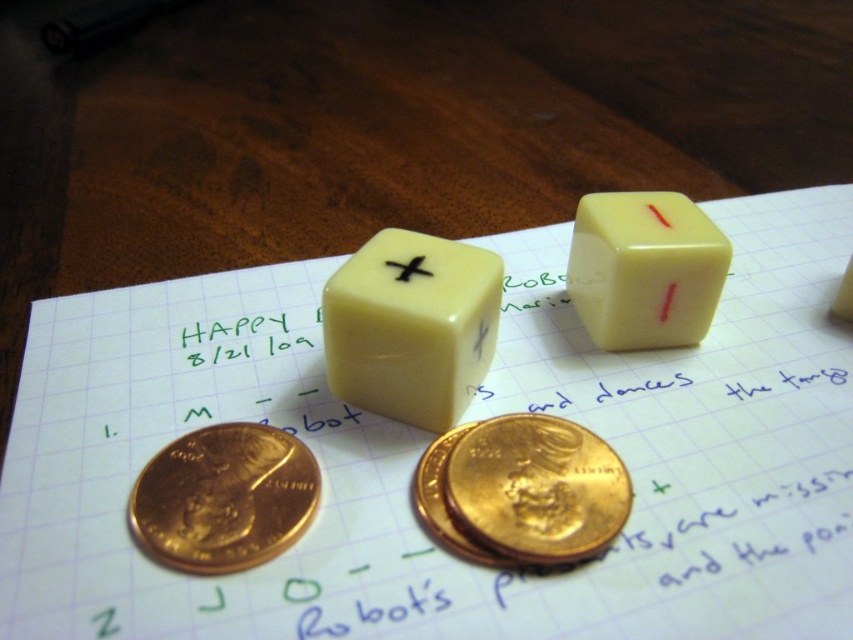
You are organizing a game night and need to place both the matte yellow die at center and the gold metallic coin at center into a small container. The container has a height limit of 2 cm. Can you fit both items vertically without exceeding the container height?

The matte yellow die at center is bigger than the gold metallic coin at center, but the exact heights of each item are not provided. Therefore, it is uncertain if they can fit vertically within the 2 cm height limit without more specific measurements.

You are setting up a board game and need to place the matte yellow die at center and the black matte x at center on the graph paper. The game rules state that these two pieces must be at least 4 inches apart. Based on the image, can you determine if their current placement meets the requirement?

The distance between the matte yellow die at center and the black matte x at center is 3.96 inches, which is slightly less than the required 4 inches. Therefore, their current placement does not meet the requirement.

You are organizing a game setup and need to place the gold metallic penny at lower left and the black matte x at center on the graph paper. According to the image, which object is closer to you?

The gold metallic penny at lower left is closer to you since it is in front of the black matte x at center.